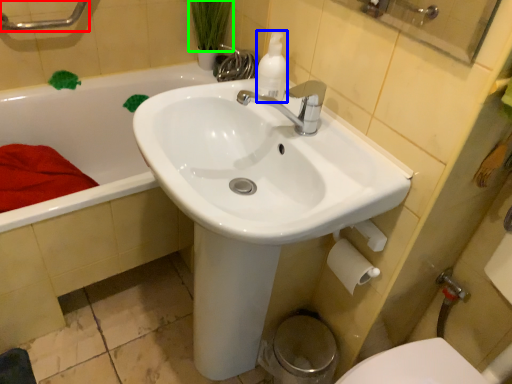
Question: Which object is the closest to the shower (highlighted by a red box)? Choose among these: cleaning product (highlighted by a blue box) or plant (highlighted by a green box).

Choices:
 (A) cleaning product
 (B) plant

Answer: (B)